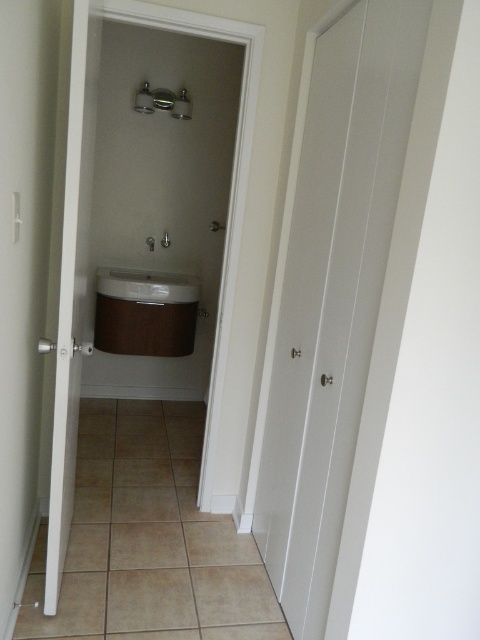
You are standing in the entrance of the bathroom and want to place a decorative plant on the floor directly in front of the wooden sink at center. According to the bathroom layout, where should you place the plant?

The wooden sink at center is located at point (144, 312), so you should place the plant directly in front of it at the corresponding coordinates on the floor.

You are designing a layout for a bathroom and need to place a new towel rack. The rack requires a minimum of 1 meter of space between it and any other fixtures. Given the current placement of the white glossy sink at center and the metallic silver shower at upper center, can you safely install the rack between them?

The white glossy sink at center is larger than the metallic silver shower at upper center. However, the exact distance between them isn not provided in the description. Without knowing the actual spacing, it is impossible to confirm if the 1 meter requirement is met. Additional measurements are needed.

You are standing in the bathroom and want to turn on the water for the sink. Which direction should you move to reach the white glossy sink at center from the metallic silver shower at upper center?

To reach the white glossy sink at center from the metallic silver shower at upper center, you should move to the left since the white glossy sink at center is located to the left of the metallic silver shower at upper center.